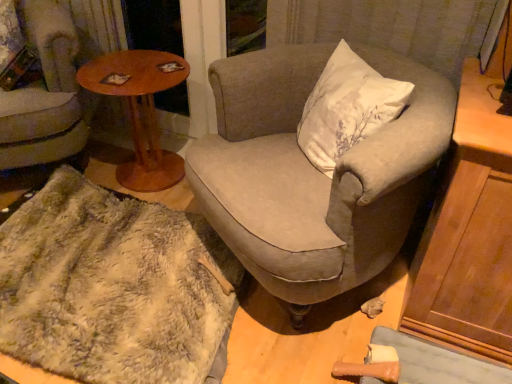
Question: Does fuzzy fabric chair at lower left, positioned as the first chair in left-to-right order, have a larger size compared to wooden round table at left?

Choices:
 (A) no
 (B) yes

Answer: (B)

Question: Considering the relative positions of fuzzy fabric chair at lower left, arranged as the 2th chair when viewed from the right, and wooden round table at left in the image provided, is fuzzy fabric chair at lower left, arranged as the 2th chair when viewed from the right, to the right of wooden round table at left from the viewer's perspective?

Choices:
 (A) yes
 (B) no

Answer: (B)

Question: Considering the relative sizes of fuzzy fabric chair at lower left, arranged as the 2th chair when viewed from the right, and wooden round table at left in the image provided, is fuzzy fabric chair at lower left, arranged as the 2th chair when viewed from the right, taller than wooden round table at left?

Choices:
 (A) no
 (B) yes

Answer: (B)

Question: Could wooden round table at left be considered to be inside fuzzy fabric chair at lower left, positioned as the first chair in left-to-right order?

Choices:
 (A) no
 (B) yes

Answer: (A)

Question: Considering the relative sizes of fuzzy fabric chair at lower left, positioned as the first chair in left-to-right order, and wooden round table at left in the image provided, is fuzzy fabric chair at lower left, positioned as the first chair in left-to-right order, wider than wooden round table at left?

Choices:
 (A) yes
 (B) no

Answer: (A)

Question: Is wooden round table at left inside or outside of fuzzy fabric chair at lower left, positioned as the first chair in left-to-right order?

Choices:
 (A) outside
 (B) inside

Answer: (A)

Question: Is point (84, 87) closer or farther from the camera than point (10, 92)?

Choices:
 (A) farther
 (B) closer

Answer: (B)

Question: Is wooden round table at left to the left or to the right of fuzzy fabric chair at lower left, positioned as the first chair in left-to-right order, in the image?

Choices:
 (A) right
 (B) left

Answer: (A)

Question: From the image's perspective, is wooden round table at left positioned above or below fuzzy fabric chair at lower left, arranged as the 2th chair when viewed from the right?

Choices:
 (A) above
 (B) below

Answer: (B)

Question: Is fuzzy fabric chair at lower left, positioned as the first chair in left-to-right order, taller or shorter than textured gray armchair at center, the first chair positioned from the right?

Choices:
 (A) short
 (B) tall

Answer: (B)

Question: In terms of size, does fuzzy fabric chair at lower left, arranged as the 2th chair when viewed from the right, appear bigger or smaller than textured gray armchair at center, marked as the second chair in a left-to-right arrangement?

Choices:
 (A) small
 (B) big

Answer: (A)

Question: Do you think fuzzy fabric chair at lower left, positioned as the first chair in left-to-right order, is within textured gray armchair at center, the first chair positioned from the right, or outside of it?

Choices:
 (A) outside
 (B) inside

Answer: (A)

Question: From a real-world perspective, relative to textured gray armchair at center, the first chair positioned from the right, is fuzzy fabric chair at lower left, positioned as the first chair in left-to-right order, vertically above or below?

Choices:
 (A) above
 (B) below

Answer: (A)

Question: Is textured gray armchair at center, marked as the second chair in a left-to-right arrangement, taller or shorter than fuzzy white blanket at lower left?

Choices:
 (A) short
 (B) tall

Answer: (B)

Question: Is point (358, 142) closer or farther from the camera than point (124, 316)?

Choices:
 (A) farther
 (B) closer

Answer: (B)